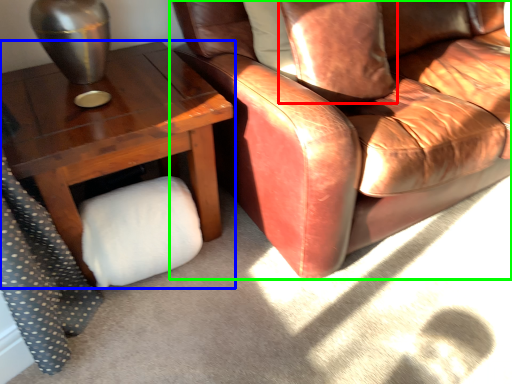
Question: Which object is the farthest from pillow (highlighted by a red box)? Choose among these: table (highlighted by a blue box) or chair (highlighted by a green box).

Choices:
 (A) table
 (B) chair

Answer: (A)